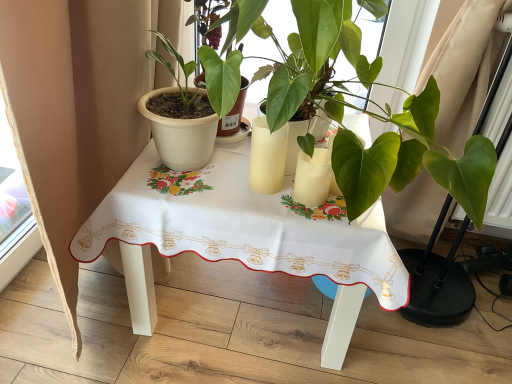
The image size is (512, 384). I want to click on vacant space that's between matte white pot at left, which ranks as the second houseplant in right-to-left order, and matte yellow glass at center, the second candle holder in the right-to-left sequence, so click(236, 170).